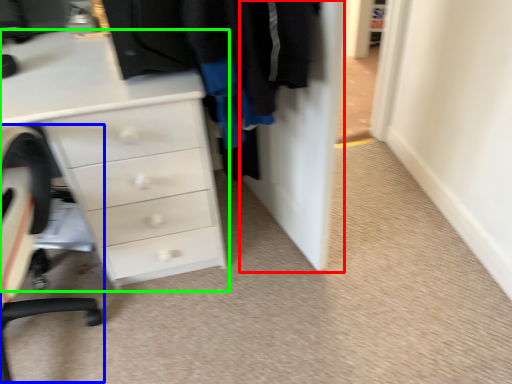
Question: Which object is positioned closest to door (highlighted by a red box)? Select from computer chair (highlighted by a blue box) and chest of drawers (highlighted by a green box).

Choices:
 (A) computer chair
 (B) chest of drawers

Answer: (B)